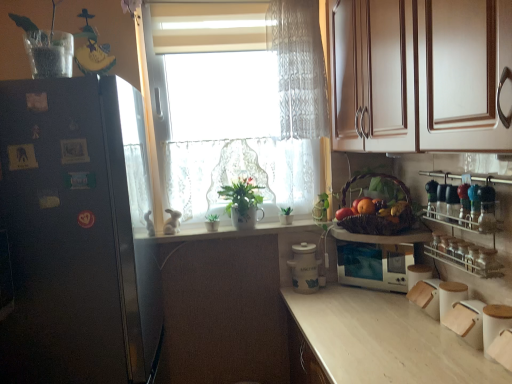
Identify the location of free space above clear glass spice rack at right (from a real-world perspective). (473, 176).